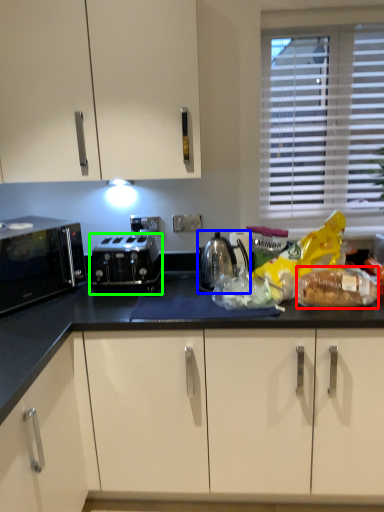
Question: Based on their relative distances, which object is nearer to stuff (highlighted by a red box)? Choose from kitchen appliance (highlighted by a blue box) and toaster (highlighted by a green box).

Choices:
 (A) kitchen appliance
 (B) toaster

Answer: (A)